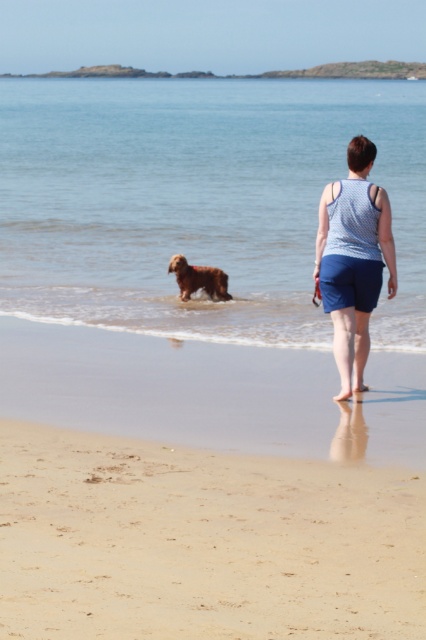
You are standing on the beach and see two points in the scene. One is at point (336,397) and the other is at point (216,272). Which point is closer to you?

Point (336,397) is closer to the viewer than point (216,272).

You are a photographer trying to capture the golden brown fur at center and the blue cotton tank top at center in the same frame. Based on the scene description, which object should you focus on first to ensure both are in focus?

The golden brown fur at center should be focused on first because the blue cotton tank top at center is located above it, meaning the fur is closer to the camera. By focusing on the closer object, both will be in focus due to the depth of field.

You are a swimmer planning to dive into the water near the clear water at dog center and the blue cotton tank top at center. Which object will you encounter first as you dive down?

The blue cotton tank top at center will be encountered first because the clear water at dog center is located above it, so the tank top is lower in the water column.